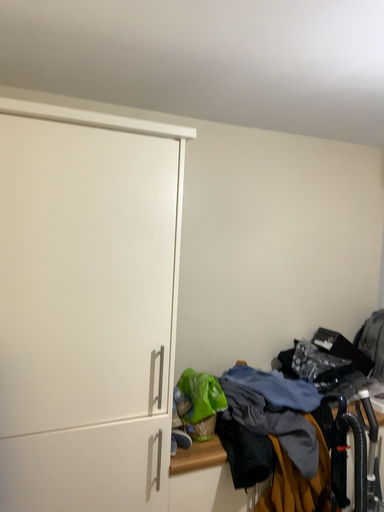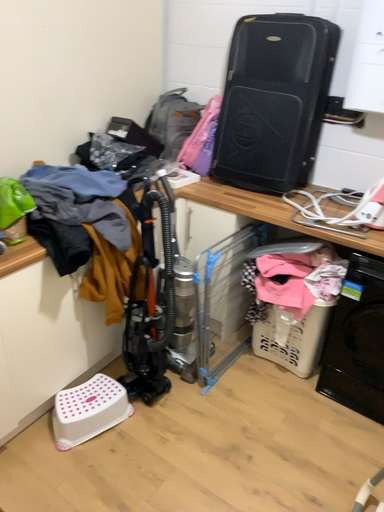
Question: How did the camera likely rotate when shooting the video?

Choices:
 (A) rotated right
 (B) rotated left

Answer: (A)